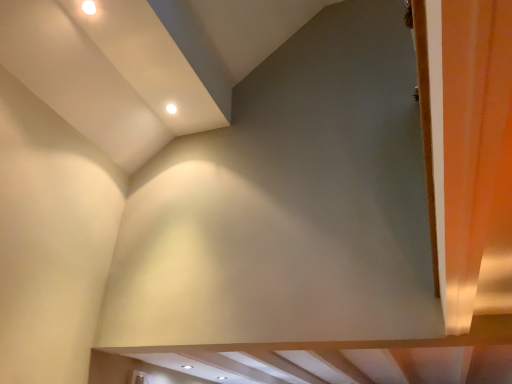
This screenshot has width=512, height=384. What are the coordinates of `orange fabric curtain at right` in the screenshot? It's located at (477, 158).

What is the approximate height of orange fabric curtain at right?

It is 3.29 inches.

What do you see at coordinates (477, 158) in the screenshot?
I see `orange fabric curtain at right` at bounding box center [477, 158].

The image size is (512, 384). What do you see at coordinates (170, 108) in the screenshot?
I see `white glossy light fixture at upper center` at bounding box center [170, 108].

Identify the location of white glossy light fixture at upper center. This screenshot has height=384, width=512. (170, 108).

This screenshot has height=384, width=512. I want to click on orange fabric curtain at right, so click(477, 158).

Considering the relative positions of white glossy light fixture at upper center and orange fabric curtain at right in the image provided, is white glossy light fixture at upper center to the left or to the right of orange fabric curtain at right?

white glossy light fixture at upper center is to the left of orange fabric curtain at right.

Is white glossy light fixture at upper center closer to the viewer compared to orange fabric curtain at right?

No, white glossy light fixture at upper center is further to the viewer.

Does point (167, 108) lie behind point (473, 244)?

Yes, point (167, 108) is behind point (473, 244).

Based on the photo, from the image's perspective, which one is positioned lower, white glossy light fixture at upper center or orange fabric curtain at right?

orange fabric curtain at right, from the image's perspective.

From a real-world perspective, is white glossy light fixture at upper center positioned above or below orange fabric curtain at right?

In terms of real-world spatial position, white glossy light fixture at upper center is above orange fabric curtain at right.

Does white glossy light fixture at upper center have a greater width compared to orange fabric curtain at right?

Incorrect, the width of white glossy light fixture at upper center does not surpass that of orange fabric curtain at right.

Considering the sizes of objects white glossy light fixture at upper center and orange fabric curtain at right in the image provided, who is shorter, white glossy light fixture at upper center or orange fabric curtain at right?

Standing shorter between the two is white glossy light fixture at upper center.

Between white glossy light fixture at upper center and orange fabric curtain at right, which one has smaller size?

With smaller size is white glossy light fixture at upper center.

Does white glossy light fixture at upper center contain orange fabric curtain at right?

Actually, orange fabric curtain at right is outside white glossy light fixture at upper center.

Is white glossy light fixture at upper center touching orange fabric curtain at right?

No, white glossy light fixture at upper center is not touching orange fabric curtain at right.

Is white glossy light fixture at upper center facing away from orange fabric curtain at right?

white glossy light fixture at upper center does not have its back to orange fabric curtain at right.

Can you tell me how much white glossy light fixture at upper center and orange fabric curtain at right differ in facing direction?

white glossy light fixture at upper center and orange fabric curtain at right are facing 0.733 degrees away from each other.

Measure the distance from white glossy light fixture at upper center to orange fabric curtain at right.

white glossy light fixture at upper center and orange fabric curtain at right are 7.37 feet apart.

Where is `lighting above the orange fabric curtain at right (from a real-world perspective)`? lighting above the orange fabric curtain at right (from a real-world perspective) is located at coordinates (170, 108).

Which object is positioned more to the right, orange fabric curtain at right or white glossy light fixture at upper center?

orange fabric curtain at right is more to the right.

Which object is further away from the camera taking this photo, orange fabric curtain at right or white glossy light fixture at upper center?

Positioned behind is white glossy light fixture at upper center.

Does point (478, 270) lie behind point (167, 106)?

No, it is in front of (167, 106).

From the image's perspective, which one is positioned lower, orange fabric curtain at right or white glossy light fixture at upper center?

orange fabric curtain at right.

From a real-world perspective, is orange fabric curtain at right physically below white glossy light fixture at upper center?

Yes, from a real-world perspective, orange fabric curtain at right is under white glossy light fixture at upper center.

Is orange fabric curtain at right wider or thinner than white glossy light fixture at upper center?

orange fabric curtain at right is wider than white glossy light fixture at upper center.

Is orange fabric curtain at right taller or shorter than white glossy light fixture at upper center?

In the image, orange fabric curtain at right appears to be taller than white glossy light fixture at upper center.

Does orange fabric curtain at right have a smaller size compared to white glossy light fixture at upper center?

No.

Is white glossy light fixture at upper center surrounded by orange fabric curtain at right?

Definitely not — white glossy light fixture at upper center is not inside orange fabric curtain at right.

Is orange fabric curtain at right far away from white glossy light fixture at upper center?

Yes.

Is orange fabric curtain at right positioned with its back to white glossy light fixture at upper center?

No.

Measure the distance between orange fabric curtain at right and white glossy light fixture at upper center.

7.37 feet.

The height and width of the screenshot is (384, 512). I want to click on lighting lying behind the orange fabric curtain at right, so coord(170,108).

Locate an element on the screen. The width and height of the screenshot is (512, 384). curtain on the right of white glossy light fixture at upper center is located at coordinates (477, 158).

You are a GUI agent. You are given a task and a screenshot of the screen. Output one action in this format:
    pyautogui.click(x=<x>, y=<y>)
    Task: Click on the curtain that is in front of the white glossy light fixture at upper center
    
    Given the screenshot: What is the action you would take?
    pyautogui.click(x=477, y=158)